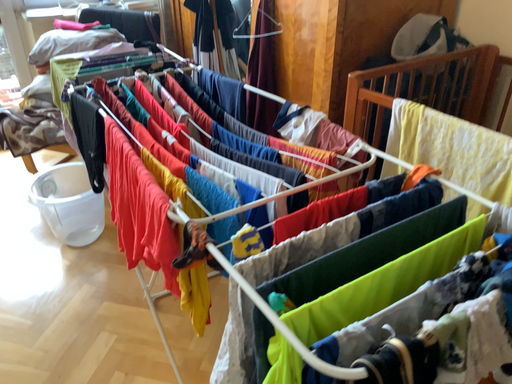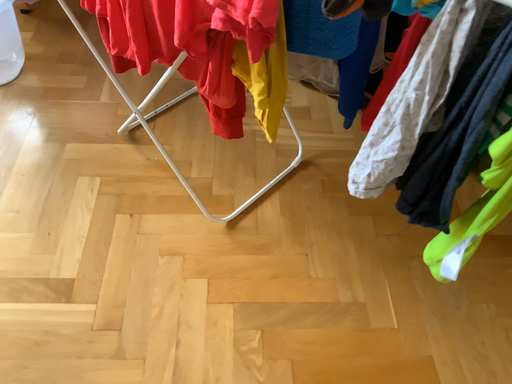
Question: How did the camera likely rotate when shooting the video?

Choices:
 (A) rotated right
 (B) rotated left

Answer: (A)